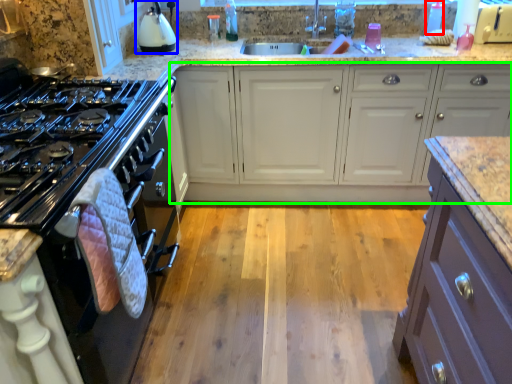
Question: Which object is the farthest from bottle (highlighted by a red box)? Choose among these: kitchen appliance (highlighted by a blue box) or cabinetry (highlighted by a green box).

Choices:
 (A) kitchen appliance
 (B) cabinetry

Answer: (A)